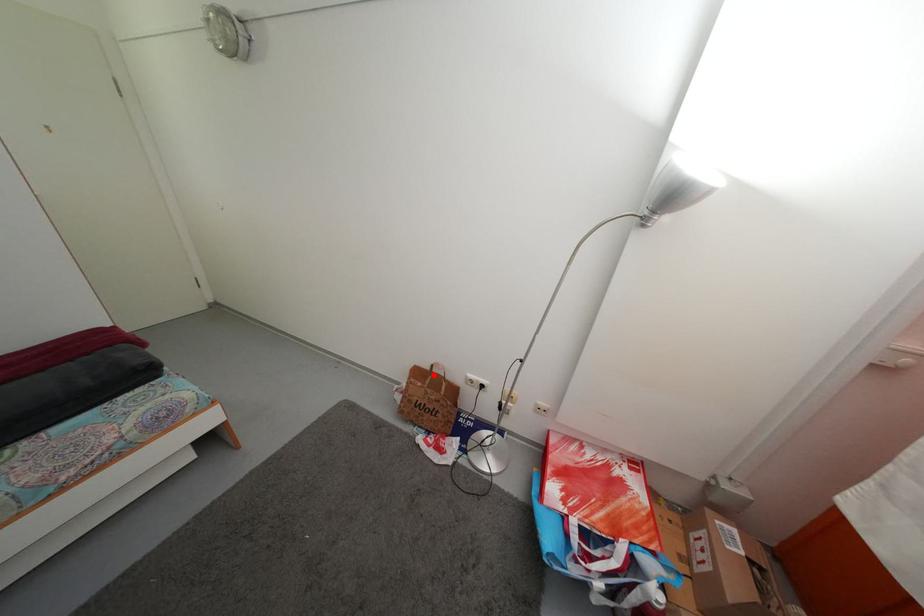
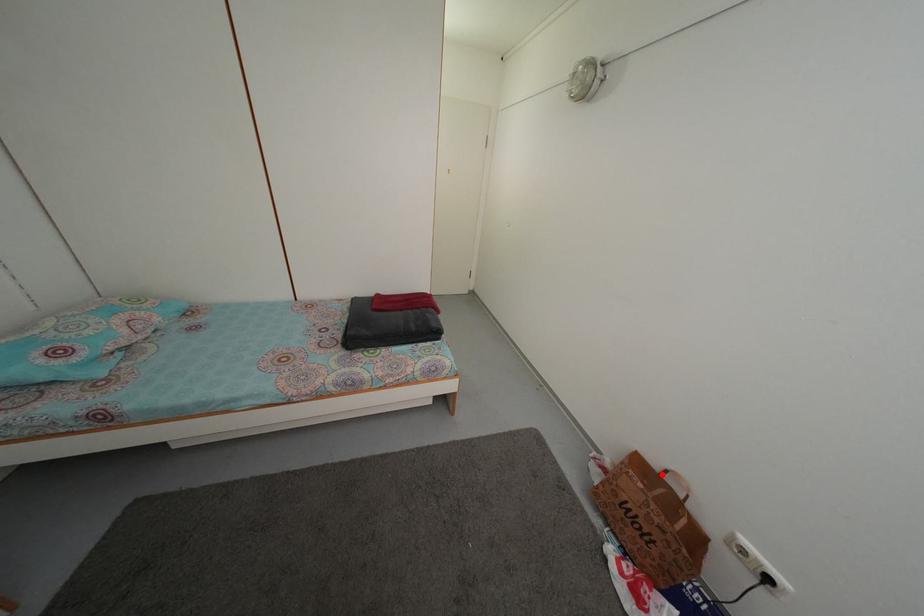
I am providing you with two images of the same scene from different viewpoints. A red point is marked on the first image and another point is marked on the second image. Does the point marked in image1 correspond to the same location as the one in image2?

Yes